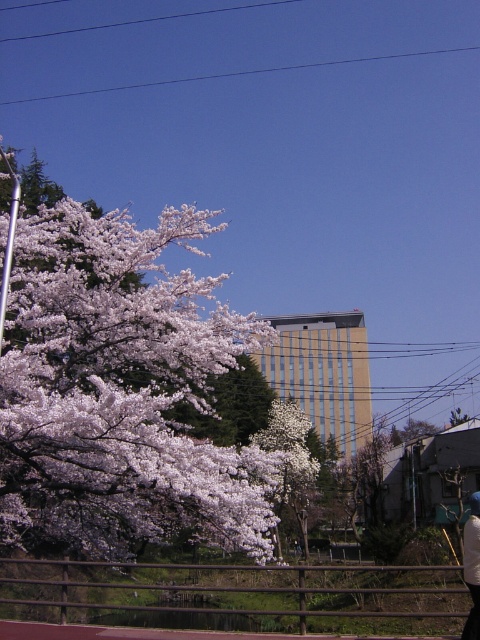
You are a photographer planning to capture the white matte flower at upper left and the white blossoming tree at center in a single shot. Based on their sizes, which object should you focus on to ensure both are clearly visible in the frame?

The white matte flower at upper left is bigger than the white blossoming tree at center, so focusing on the white matte flower at upper left will ensure both are clearly visible since it occupies more space in the frame.

You are standing at the wooden railing in the foreground of this serene outdoor scene. You notice two points marked in the image. One is at coordinate point (255, 442) and the other at point (466, 525). Which of these two points is closer to you?

Point (255, 442) is closer to you because it is further to the viewer than point (466, 525).

You are standing at the wooden railing in the foreground of the scene. You see a point marked at coordinates (116,387). Based on the scene description, can you determine what object this point is located on?

The point at (116,387) is located on the white matte flower at upper left.